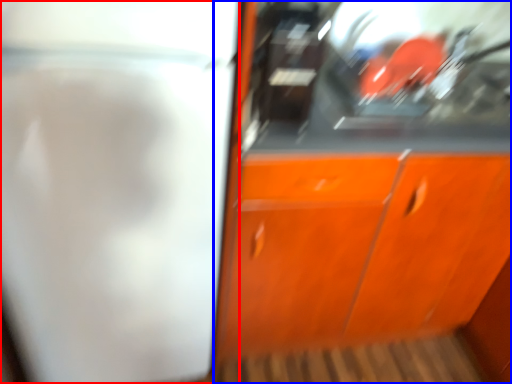
Question: Which object appears closest to the camera in this image, screen door (highlighted by a red box) or cabinetry (highlighted by a blue box)?

Choices:
 (A) screen door
 (B) cabinetry

Answer: (A)